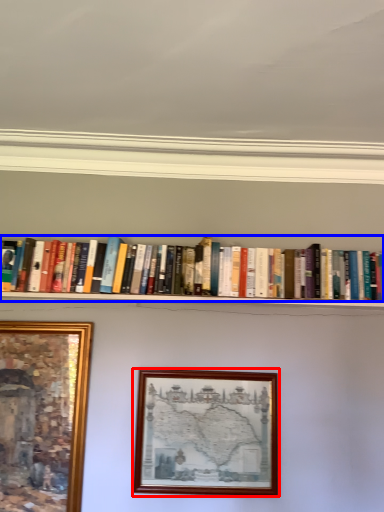
Question: Which object appears closest to the camera in this image, picture frame (highlighted by a red box) or book (highlighted by a blue box)?

Choices:
 (A) picture frame
 (B) book

Answer: (A)